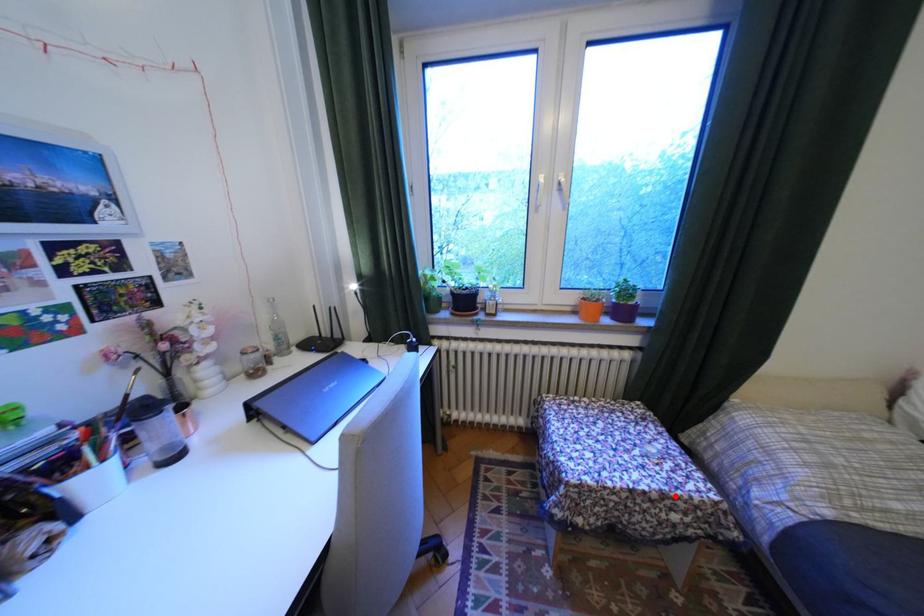
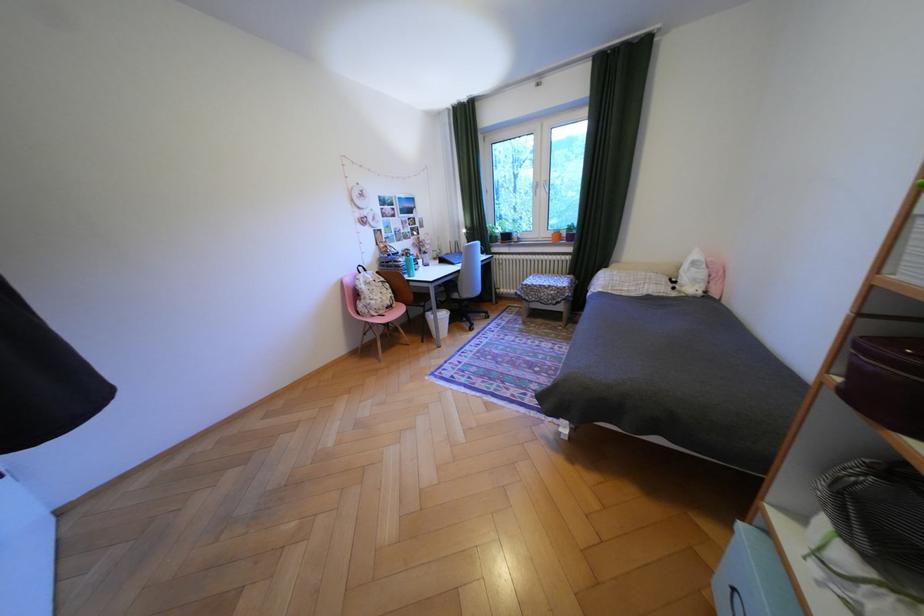
Where in the second image is the point corresponding to the highlighted location from the first image?

(562, 286)